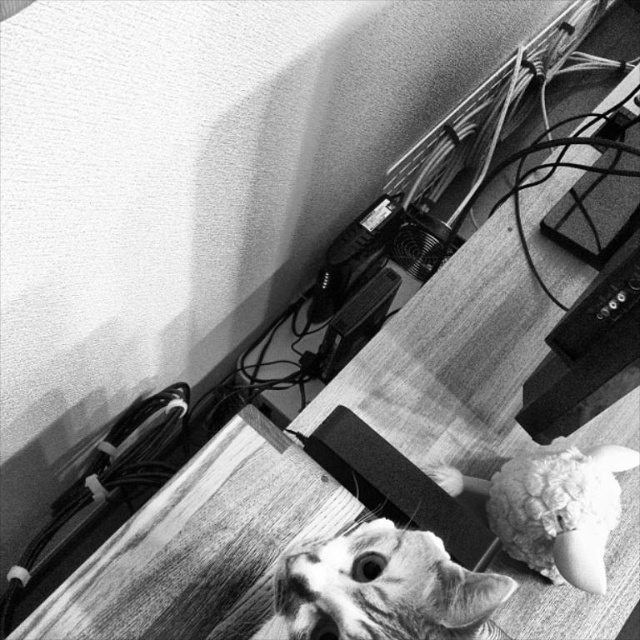
You are a photographer trying to focus on the tabby fur cat at center in this black and white photo. The camera you are using has a focus point at position point (385, 588). Will this focus point be effective for capturing the cat?

The tabby fur cat at center is located at point (385, 588), so the focus point at position point (385, 588) will be effective for capturing the cat since it is directly centered on the cat.

You are a photographer adjusting your camera settings. You notice the tabby fur cat at center and the fluffy fabric doll at lower right in your viewfinder. Which object should you focus on to ensure the subject is sharp, considering their positions relative to the camera?

You should focus on the tabby fur cat at center because it is closer to the viewer than the fluffy fabric doll at lower right, making it the primary subject in the foreground.

You are organizing a photo album and want to ensure that the tabby fur cat at center and the fluffy fabric doll at lower right are both visible in the frame. Based on their sizes in the image, which one might you need to adjust the camera angle for to ensure it fits better?

The tabby fur cat at center occupies less space than the fluffy fabric doll at lower right, so you might need to adjust the camera angle to accommodate the larger size of the fluffy fabric doll at lower right.